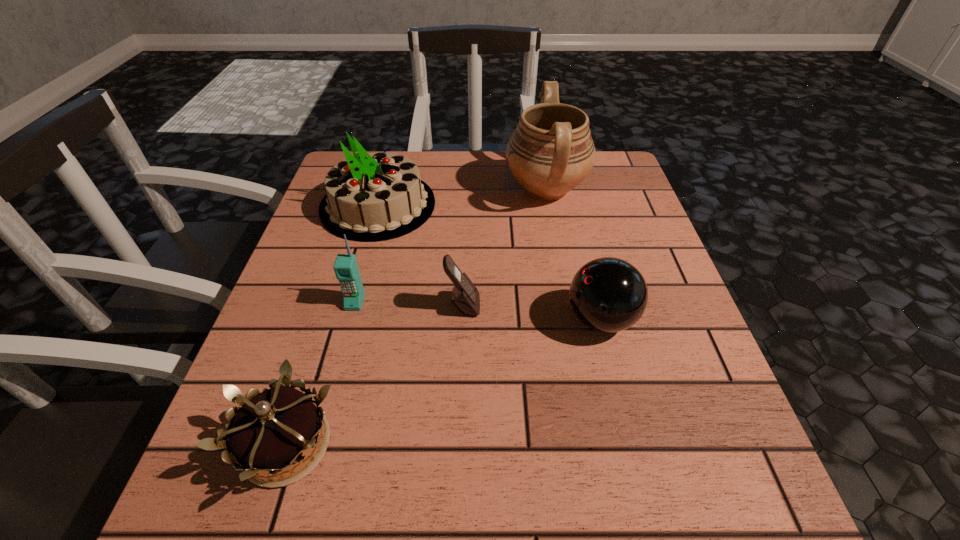
In the image, there is a desktop. Identify the location of free region at the left edge. Image resolution: width=960 pixels, height=540 pixels. (302, 309).

Find the location of a particular element. This screenshot has width=960, height=540. free region at the right edge of the desktop is located at coordinates (602, 254).

The height and width of the screenshot is (540, 960). In order to click on vacant space at the far right corner of the desktop in this screenshot , I will do `click(572, 192)`.

Locate an element on the screen. This screenshot has width=960, height=540. empty space between the urn and the left cellular telephone is located at coordinates (450, 246).

You are a GUI agent. You are given a task and a screenshot of the screen. Output one action in this format:
    pyautogui.click(x=<x>, y=<y>)
    Task: Click on the vacant space in between the tallest object and the left cellular telephone
    
    Given the screenshot: What is the action you would take?
    pyautogui.click(x=450, y=246)

The height and width of the screenshot is (540, 960). Find the location of `unoccupied area between the urn and the bowling ball`. unoccupied area between the urn and the bowling ball is located at coordinates (573, 254).

Locate an element on the screen. Image resolution: width=960 pixels, height=540 pixels. vacant area between the fifth shortest object and the third object from right to left is located at coordinates (420, 255).

Image resolution: width=960 pixels, height=540 pixels. I want to click on free space between the taller cellular telephone and the second tallest object, so click(x=367, y=254).

Locate an element on the screen. empty space that is in between the bowling ball and the right cellular telephone is located at coordinates (532, 312).

Identify the location of free space between the birthday cake and the taller cellular telephone. (367, 254).